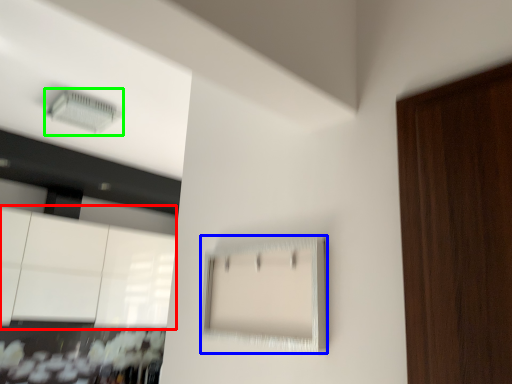
Question: Considering the real-world distances, which object is closest to cabinetry (highlighted by a red box)? cabinetry (highlighted by a blue box) or air conditioning (highlighted by a green box).

Choices:
 (A) cabinetry
 (B) air conditioning

Answer: (B)